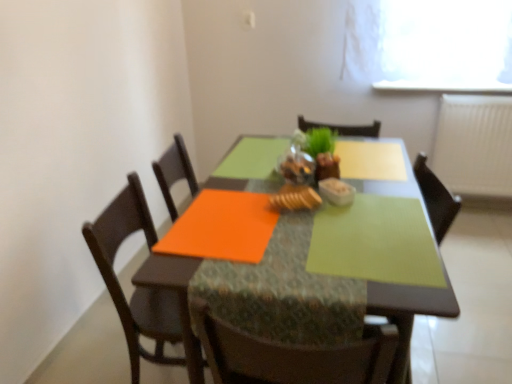
Where is `vacant area on top of green matte placemat at center (from a real-world perspective)`? vacant area on top of green matte placemat at center (from a real-world perspective) is located at coordinates (374, 227).